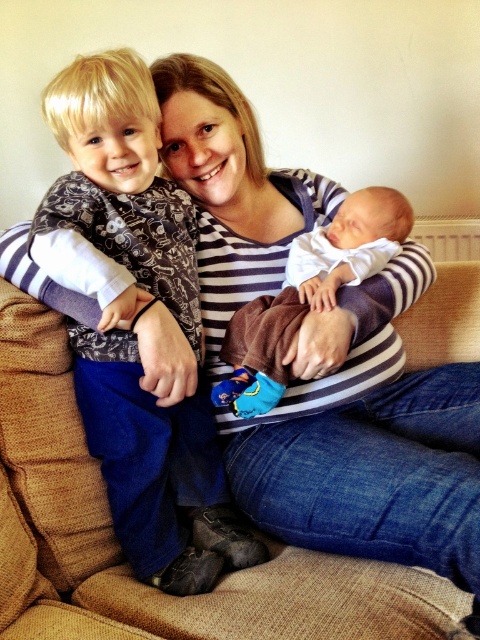
Question: Is striped fabric at center positioned before matte black shirt at left?

Choices:
 (A) yes
 (B) no

Answer: (A)

Question: In this image, where is striped fabric at center located relative to brown soft blanket at center?

Choices:
 (A) below
 (B) above

Answer: (A)

Question: Is matte black shirt at left positioned behind brown soft blanket at center?

Choices:
 (A) no
 (B) yes

Answer: (A)

Question: Among these objects, which one is farthest from the camera?

Choices:
 (A) matte black shirt at left
 (B) brown soft blanket at center

Answer: (B)

Question: Which point is closer to the camera?

Choices:
 (A) brown soft blanket at center
 (B) striped fabric at center

Answer: (B)

Question: Which of these objects is positioned closest to the striped fabric at center?

Choices:
 (A) matte black shirt at left
 (B) brown soft blanket at center

Answer: (B)